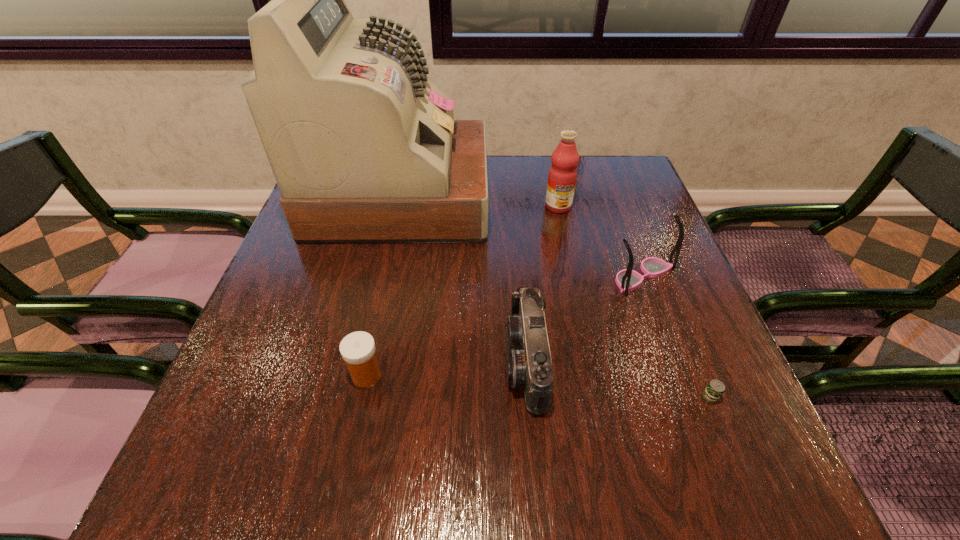
The height and width of the screenshot is (540, 960). Identify the location of beer can that is at the right edge. (714, 390).

Image resolution: width=960 pixels, height=540 pixels. I want to click on object present at the far left corner, so click(364, 149).

Image resolution: width=960 pixels, height=540 pixels. I want to click on free spot at the far edge of the desktop, so click(534, 178).

This screenshot has height=540, width=960. Identify the location of vacant space at the near edge of the desktop. (581, 464).

Locate an element on the screen. This screenshot has width=960, height=540. vacant space at the left edge of the desktop is located at coordinates (324, 318).

Locate an element on the screen. vacant point at the right edge is located at coordinates (650, 350).

You are a GUI agent. You are given a task and a screenshot of the screen. Output one action in this format:
    pyautogui.click(x=<x>, y=<y>)
    Task: Click on the free space at the near left corner
    The height and width of the screenshot is (540, 960).
    Given the screenshot: What is the action you would take?
    pyautogui.click(x=256, y=476)

Identify the location of free space at the far right corner. Image resolution: width=960 pixels, height=540 pixels. (632, 170).

At what (x,y) coordinates should I click in order to perform the action: click on free point between the fifth shortest object and the medicine. Please return your answer as a coordinate pair (x, y). Looking at the image, I should click on tap(463, 291).

Where is `empty location between the tallest object and the shortest object`? The image size is (960, 540). empty location between the tallest object and the shortest object is located at coordinates (555, 297).